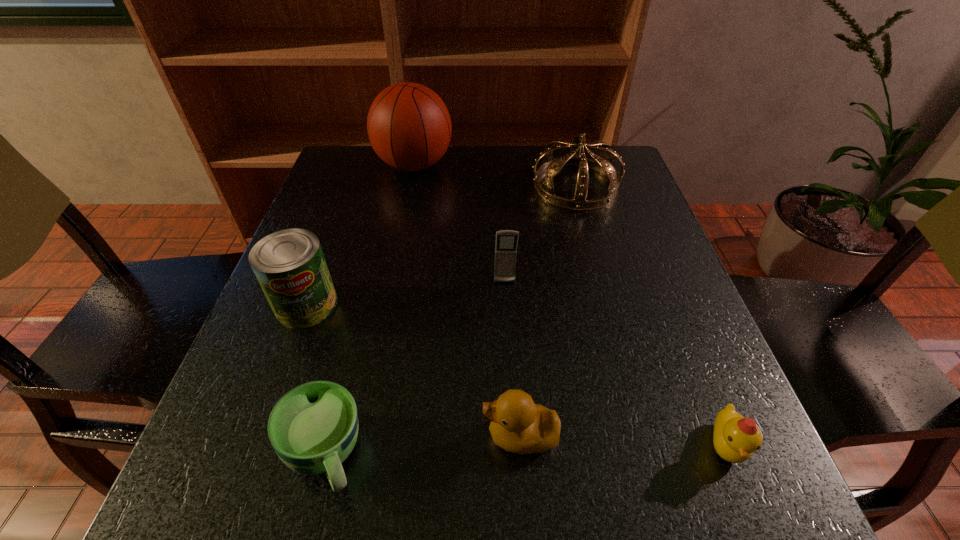
The height and width of the screenshot is (540, 960). Find the location of `free region located on the front-facing side of the cellular telephone`. free region located on the front-facing side of the cellular telephone is located at coordinates (510, 377).

At what (x,y) coordinates should I click in order to perform the action: click on free spot located 0.100m facing forward on the left duckling. Please return your answer as a coordinate pair (x, y). Looking at the image, I should click on (416, 436).

Image resolution: width=960 pixels, height=540 pixels. Find the location of `free space located 0.400m facing forward on the left duckling`. free space located 0.400m facing forward on the left duckling is located at coordinates (214, 436).

Find the location of a particular element. This screenshot has height=540, width=960. vacant region located 0.320m facing forward on the left duckling is located at coordinates (268, 436).

The image size is (960, 540). I want to click on vacant position located 0.170m on the right of the cup, so click(482, 454).

You are a GUI agent. You are given a task and a screenshot of the screen. Output one action in this format:
    pyautogui.click(x=<x>, y=<y>)
    Task: Click on the basketball located in the far edge section of the desktop
    This screenshot has height=540, width=960.
    Given the screenshot: What is the action you would take?
    pyautogui.click(x=409, y=127)

Locate an element on the screen. tiara that is positioned at the far edge is located at coordinates (602, 163).

This screenshot has width=960, height=540. Find the location of `cup present at the near edge`. cup present at the near edge is located at coordinates (313, 428).

The image size is (960, 540). I want to click on basketball that is at the left edge, so click(x=409, y=127).

I want to click on can that is at the left edge, so 290,266.